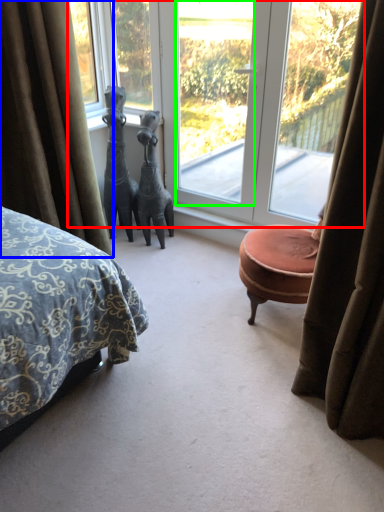
Question: Which object is positioned farthest from window (highlighted by a red box)? Select from curtain (highlighted by a blue box) and window screen (highlighted by a green box).

Choices:
 (A) curtain
 (B) window screen

Answer: (A)